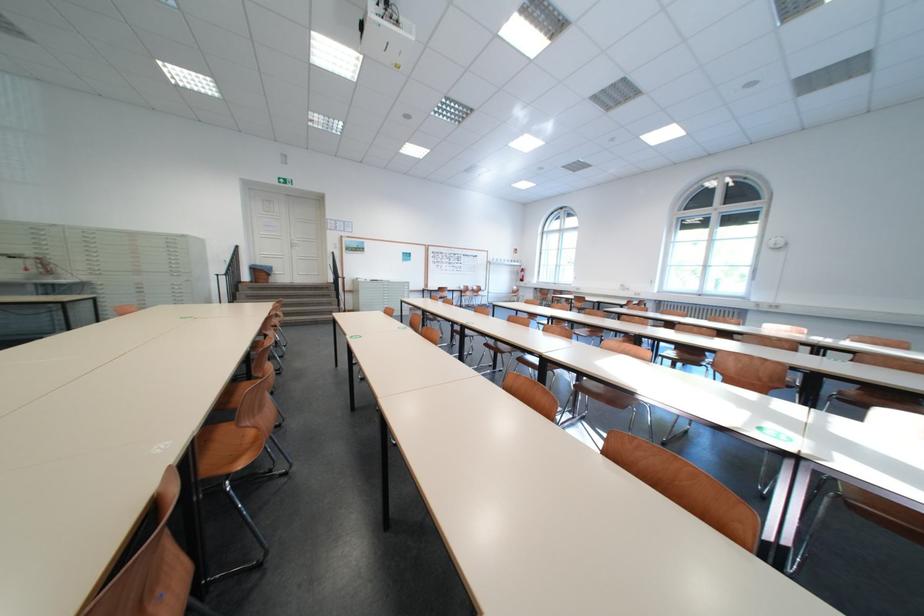
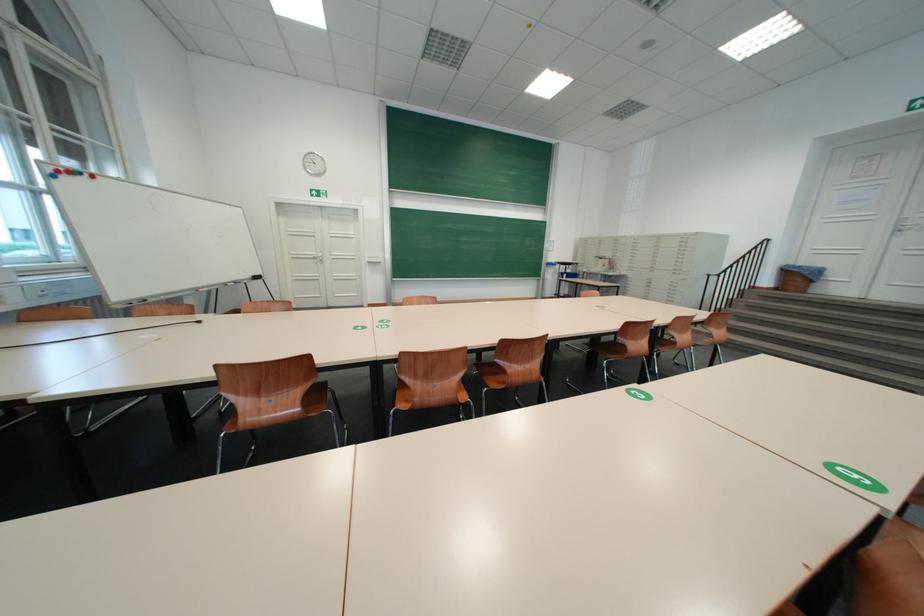
Where in the second image is the point corresponding to [51,230] from the first image?

(630, 241)